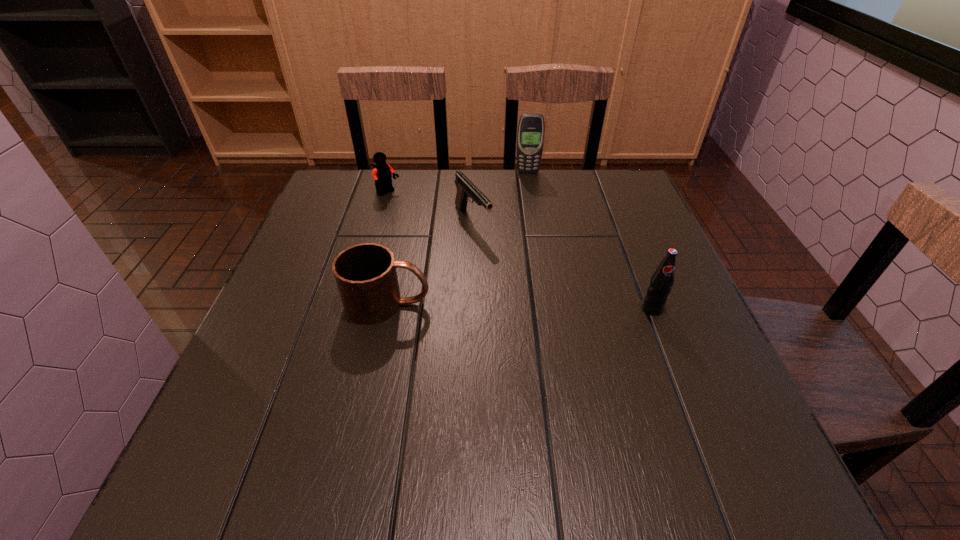
In the image, there is a desktop. At what (x,y) coordinates should I click in order to perform the action: click on free region at the near left corner. Please return your answer as a coordinate pair (x, y). The image size is (960, 540). Looking at the image, I should click on (259, 421).

Identify the location of vacant space at the far right corner. The image size is (960, 540). (588, 207).

In the image, there is a desktop. Where is `vacant space at the near right corner`? vacant space at the near right corner is located at coordinates (684, 402).

This screenshot has width=960, height=540. Identify the location of free area in between the second tallest object and the second farthest object. (520, 251).

Where is `vacant point located between the fourth object from left to right and the rightmost object`? This screenshot has width=960, height=540. vacant point located between the fourth object from left to right and the rightmost object is located at coordinates (589, 240).

What are the coordinates of `blank region between the fourth nearest object and the third object from right to left` in the screenshot? It's located at (430, 207).

The image size is (960, 540). Find the location of `unoccupied position between the pop and the Lego`. unoccupied position between the pop and the Lego is located at coordinates (520, 251).

The width and height of the screenshot is (960, 540). I want to click on blank region between the mug and the farthest object, so click(x=458, y=238).

This screenshot has width=960, height=540. In order to click on vacant region between the rightmost object and the farthest object in this screenshot , I will do `click(589, 240)`.

You are a GUI agent. You are given a task and a screenshot of the screen. Output one action in this format:
    pyautogui.click(x=<x>, y=<y>)
    Task: Click on the vacant area between the farthest object and the mug
    Image resolution: width=960 pixels, height=540 pixels.
    Given the screenshot: What is the action you would take?
    (x=458, y=238)